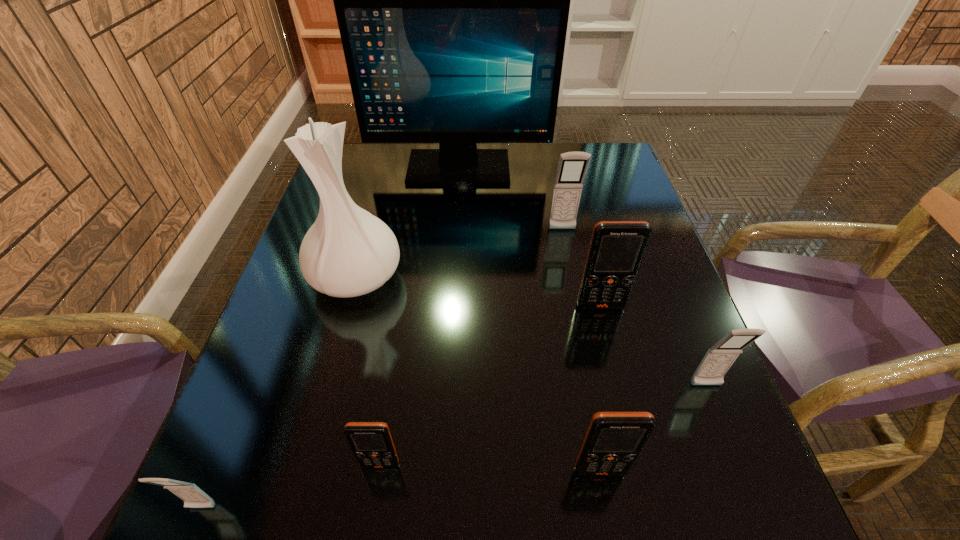
What are the coordinates of `gray cellular telephone that is the second closest to the white vase` in the screenshot? It's located at coord(193,497).

Identify which orange cellular telephone is the third closest to the second tallest object. Please provide its 2D coordinates. Your answer should be formatted as a tuple, i.e. [(x, y)], where the tuple contains the x and y coordinates of a point satisfying the conditions above.

[(613, 441)]

Locate an element on the screen. This screenshot has width=960, height=540. the second closest orange cellular telephone to the farthest cellular telephone is located at coordinates (613, 441).